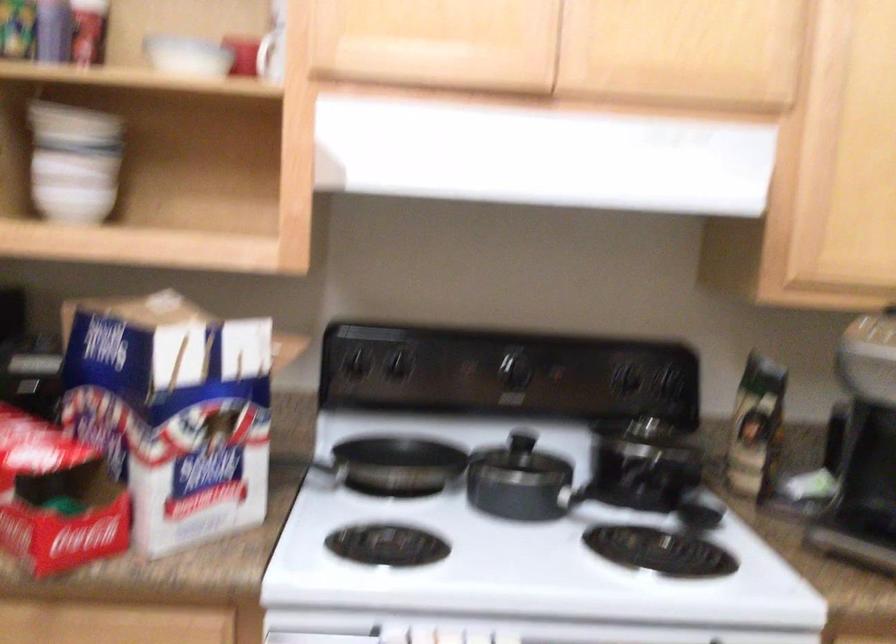
What do you see at coordinates (755, 426) in the screenshot? I see `the spice bottle` at bounding box center [755, 426].